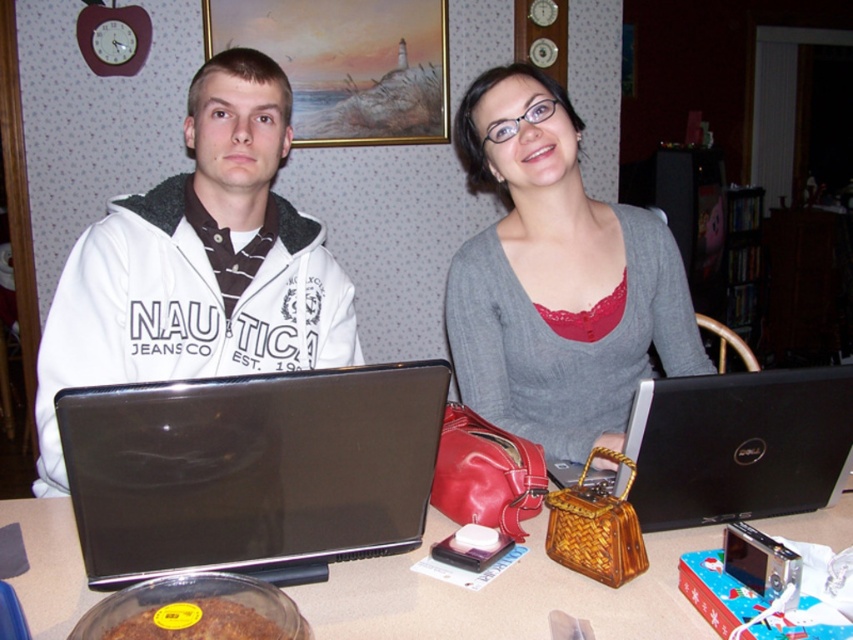
You are standing in front of the table where the two people are sitting. There is a point at coordinates (146, 474) on the table. If you want to place a 12 inch ruler on the table so that one end is exactly at that point, will the ruler extend beyond the edge of the table?

The point at coordinates (146, 474) is 37.06 inches away from you. Since the ruler is 12 inches long, placing it from that point towards you would leave 25.06 inches of space before reaching the edge. Therefore, the ruler will not extend beyond the edge of the table.

You are a photographer standing in front of the table. You want to take a photo of the white matte jacket at center and the black matte laptop at right. Which object will appear larger in the photo?

The white matte jacket at center will appear larger in the photo because it is closer to the photographer than the black matte laptop at right.

You are a delivery person who needs to place a small package on the table between the matte black laptop at left and the black matte laptop at right. Based on their positions, where should you place the package to ensure it doesn

The matte black laptop at left is positioned over the black matte laptop at right, so placing the package between them would require positioning it to the side of both laptops rather than between their overlapping areas.